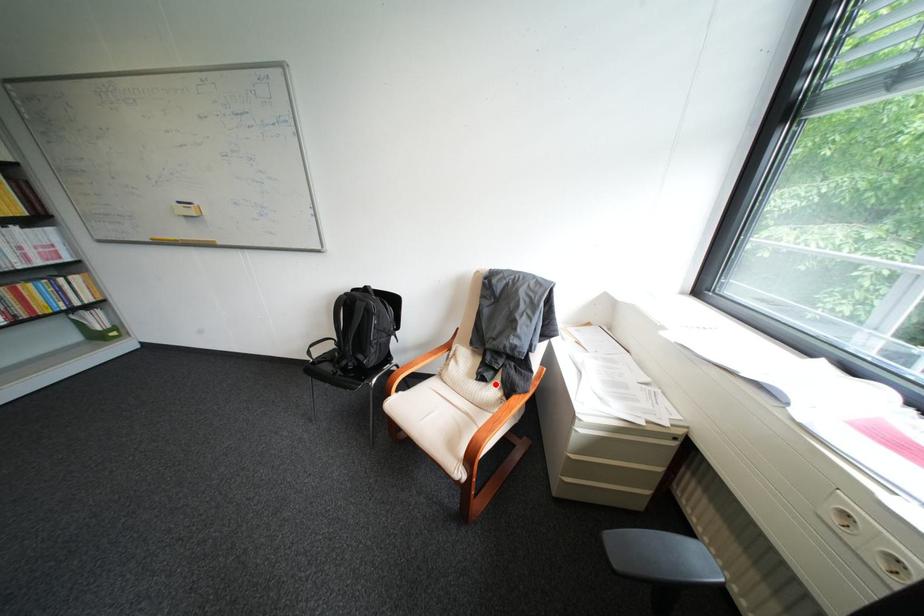
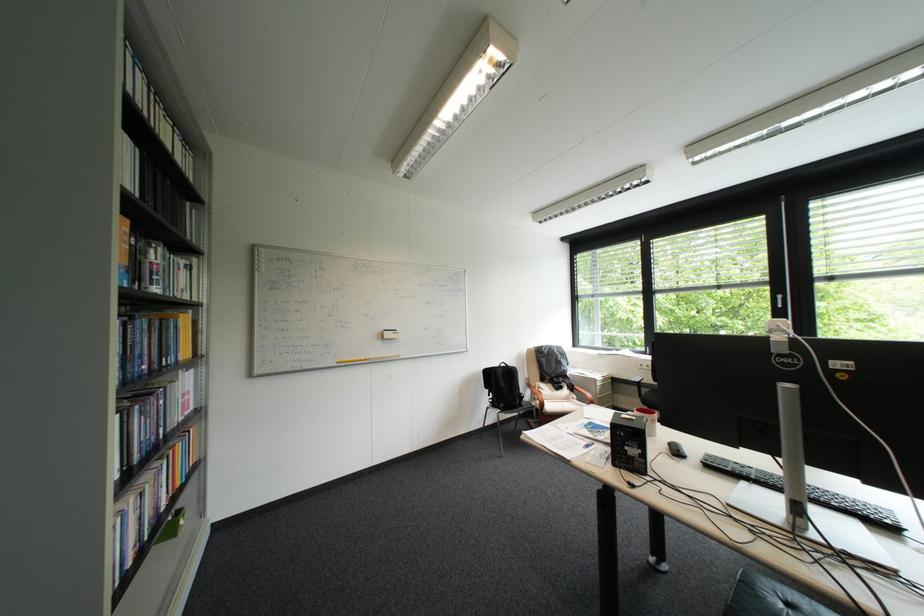
Question: I am providing you with two images of the same scene from different viewpoints. In image1, a red point is highlighted. Considering the same 3D point in image2, which of the following is correct?

Choices:
 (A) It is closer
 (B) It is farther

Answer: (B)